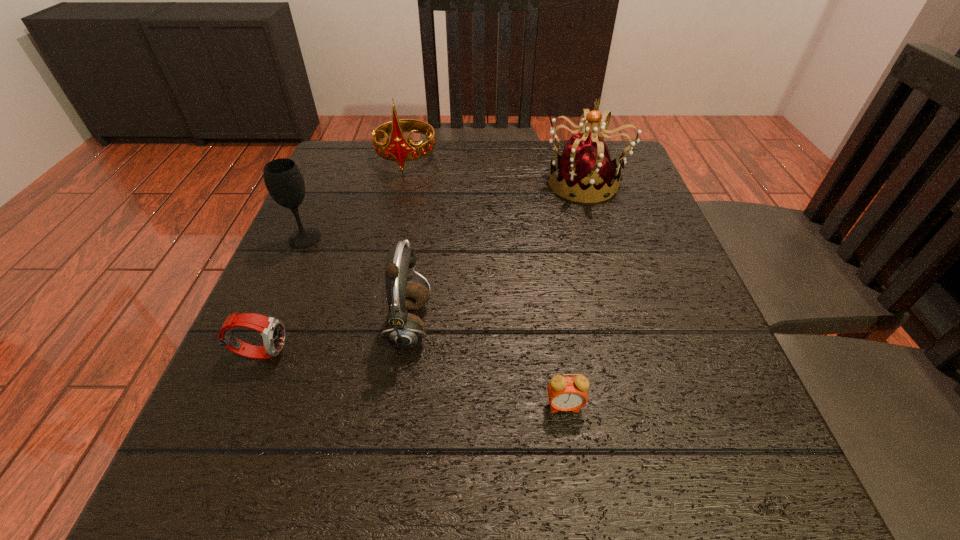
This screenshot has width=960, height=540. Identify the location of free space located 0.400m on the front-facing side of the left tiara. (373, 299).

Identify the location of vacant region located on the ear pads of the earphone. (508, 326).

You are a GUI agent. You are given a task and a screenshot of the screen. Output one action in this format:
    pyautogui.click(x=<x>, y=<y>)
    Task: Click on the vacant area situated 0.170m on the front of the fourth nearest object
    
    Given the screenshot: What is the action you would take?
    pyautogui.click(x=272, y=314)

Locate an element on the screen. Image resolution: width=960 pixels, height=540 pixels. vacant space situated 0.070m on the face of the watch is located at coordinates (332, 352).

At what (x,y) coordinates should I click in order to perform the action: click on vacant space located on the face of the alarm clock. Please return your answer as a coordinate pair (x, y). The image size is (960, 540). Looking at the image, I should click on (576, 488).

In order to click on tiara situated at the left edge in this screenshot , I will do `click(398, 148)`.

Where is `wineglass present at the left edge`? This screenshot has width=960, height=540. wineglass present at the left edge is located at coordinates (284, 181).

At what (x,y) coordinates should I click in order to perform the action: click on watch at the left edge. Please return your answer as a coordinate pair (x, y). Looking at the image, I should click on (272, 330).

At what (x,y) coordinates should I click in order to perform the action: click on object at the right edge. Please return your answer as a coordinate pair (x, y). This screenshot has width=960, height=540. Looking at the image, I should click on (585, 171).

At what (x,y) coordinates should I click in order to perform the action: click on object located in the far left corner section of the desktop. Please return your answer as a coordinate pair (x, y). The width and height of the screenshot is (960, 540). Looking at the image, I should click on (398, 148).